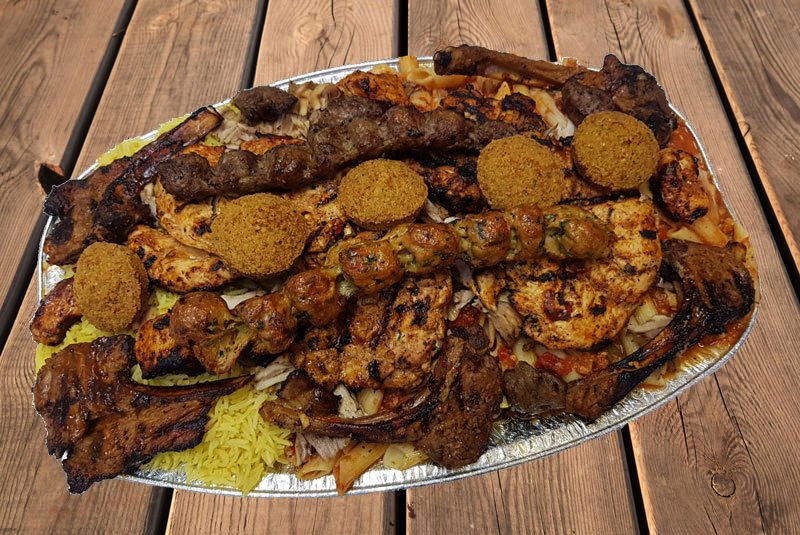
Where is `aluminum tray`? aluminum tray is located at coordinates (522, 448).